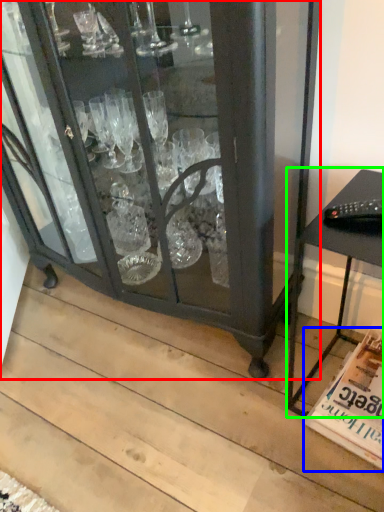
Question: Based on their relative distances, which object is nearer to furniture (highlighted by a red box)? Choose from magazine (highlighted by a blue box) and table (highlighted by a green box).

Choices:
 (A) magazine
 (B) table

Answer: (B)